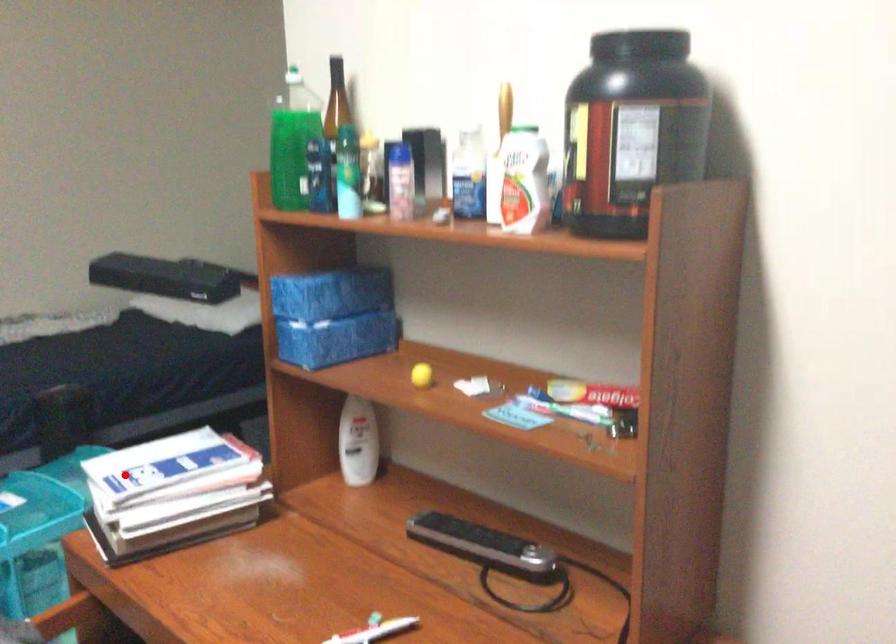
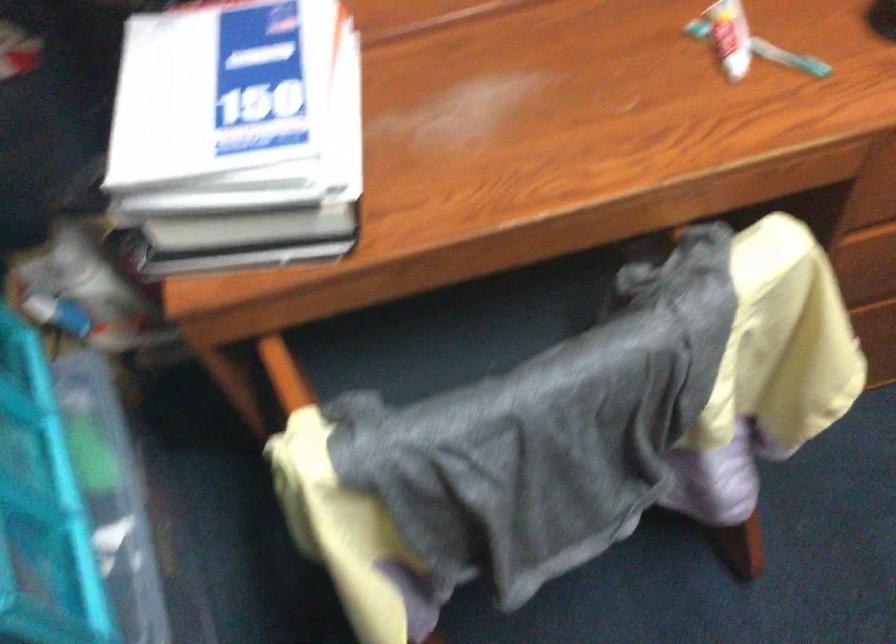
Question: A red point is marked in image1. In image2, is the corresponding 3D point closer to the camera or farther? Reply with the corresponding letter.

Choices:
 (A) The corresponding 3D point is closer.
 (B) The corresponding 3D point is farther.

Answer: (A)